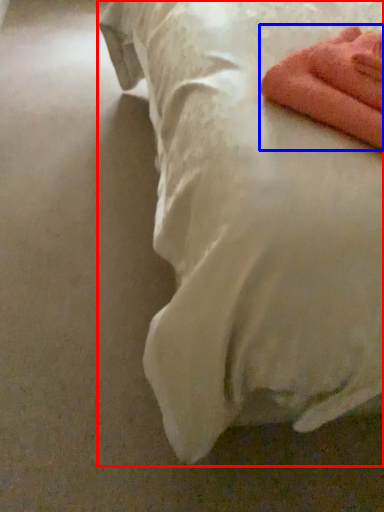
Question: Which object appears farthest to the camera in this image, bed (highlighted by a red box) or towel (highlighted by a blue box)?

Choices:
 (A) bed
 (B) towel

Answer: (B)